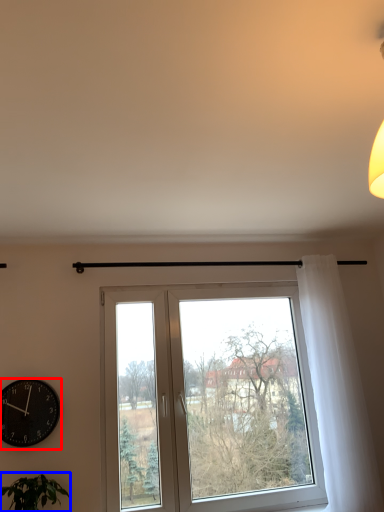
Question: Which of the following is the closest to the observer, wall clock (highlighted by a red box) or houseplant (highlighted by a blue box)?

Choices:
 (A) wall clock
 (B) houseplant

Answer: (B)